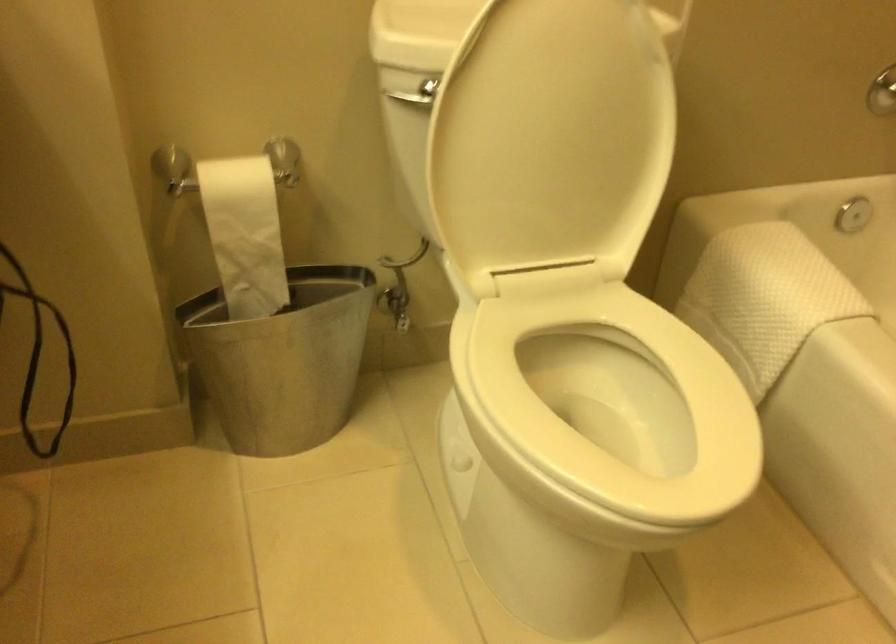
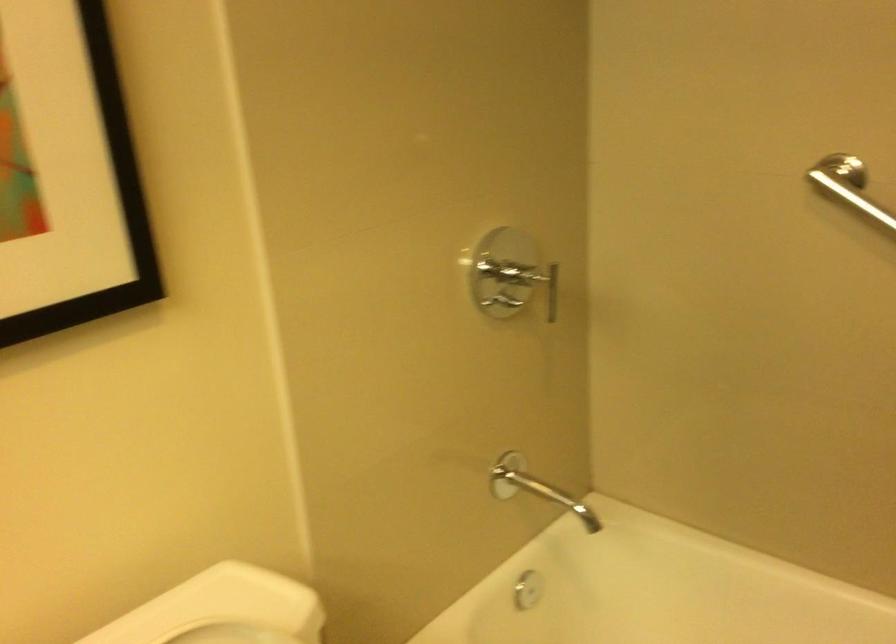
Question: The camera is either moving clockwise (left) or counter-clockwise (right) around the object. The first image is from the beginning of the video and the second image is from the end. Is the camera moving left or right when shooting the video?

Choices:
 (A) Left
 (B) Right

Answer: (A)